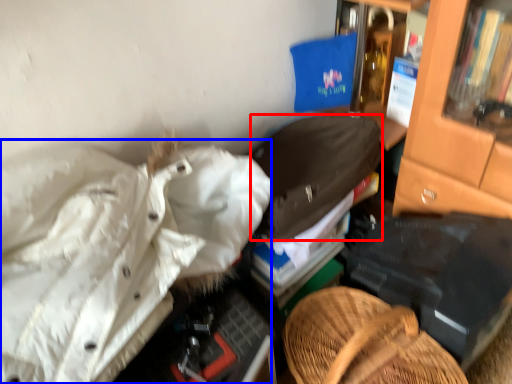
Question: Which object is further to the camera taking this photo, clothing (highlighted by a red box) or clothing (highlighted by a blue box)?

Choices:
 (A) clothing
 (B) clothing

Answer: (A)